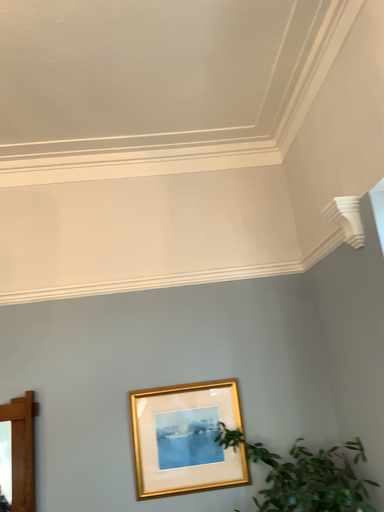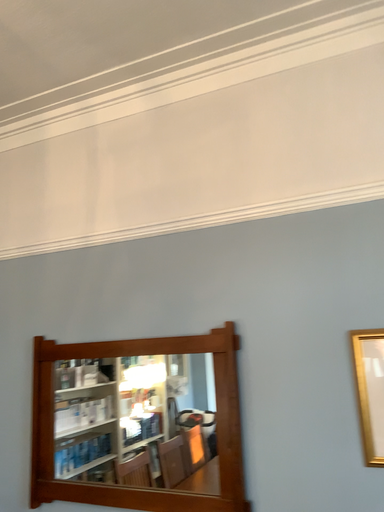
Question: Which way did the camera rotate in the video?

Choices:
 (A) rotated downward
 (B) rotated upward

Answer: (A)